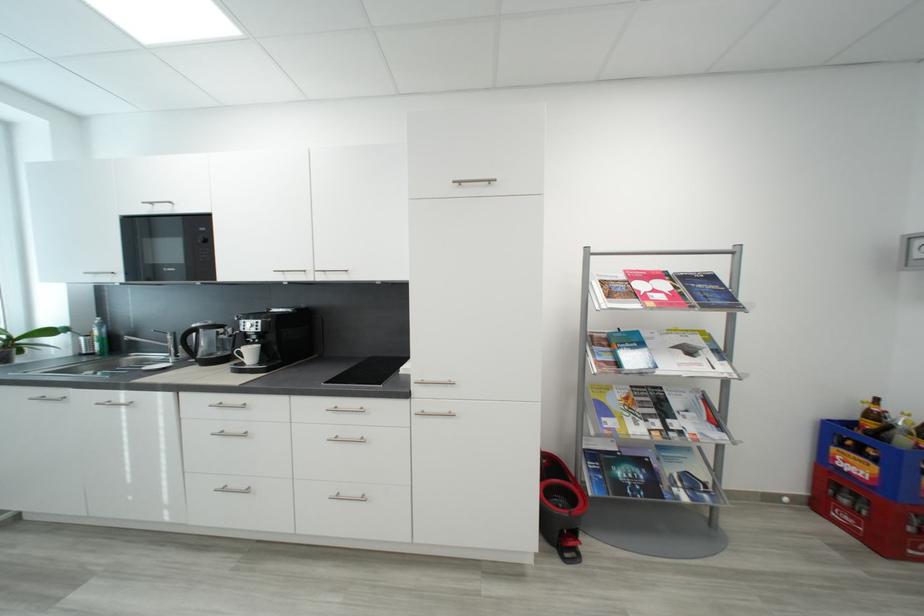
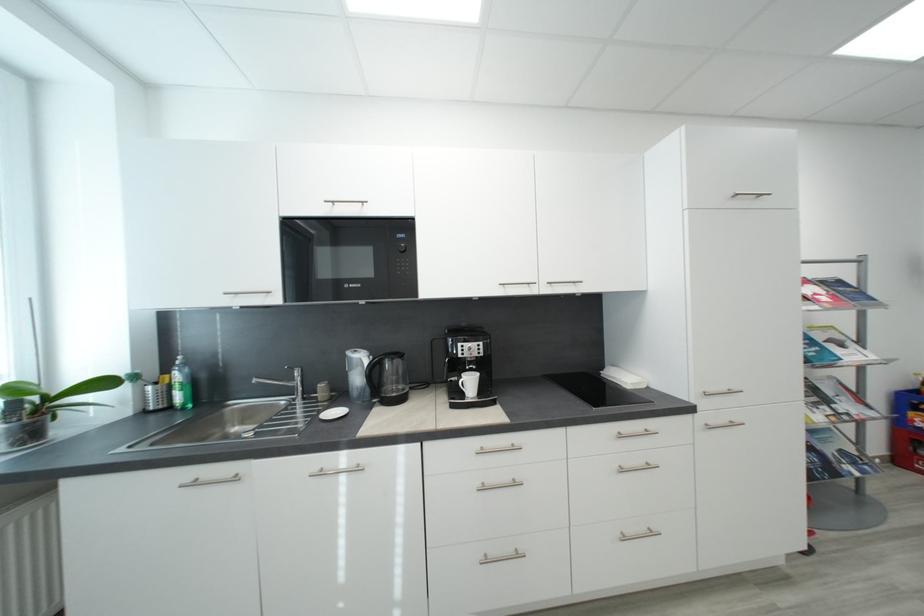
Question: In a continuous first-person perspective shot, in which direction is the camera moving?

Choices:
 (A) Left
 (B) Right
 (C) Forward
 (D) Backward

Answer: (A)